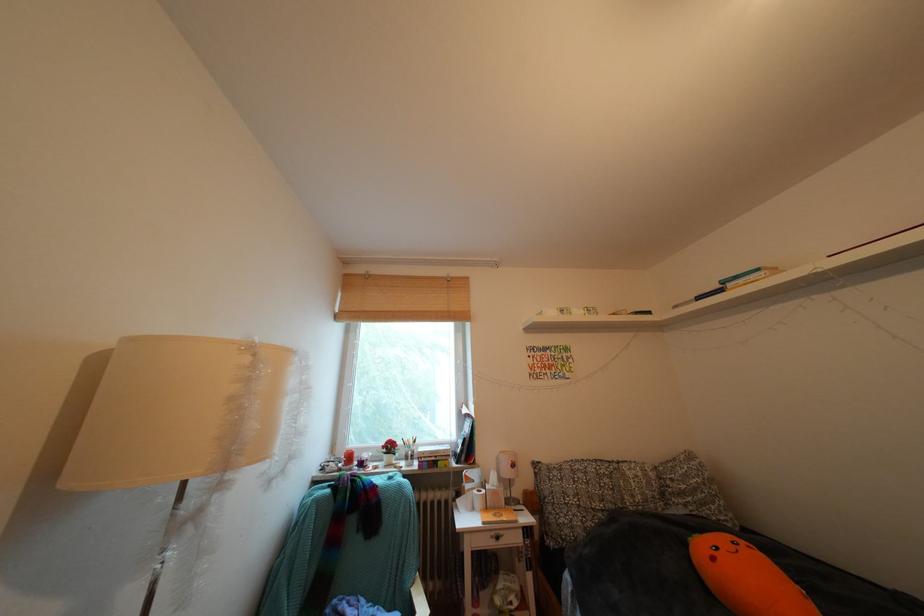
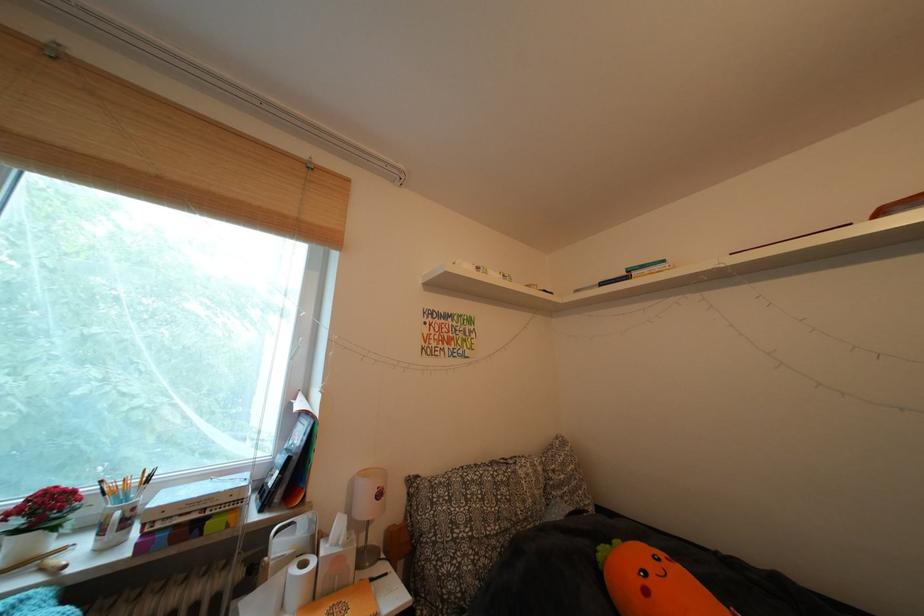
Find the pixel in the second image that matches (400,452) in the first image.

(56, 513)